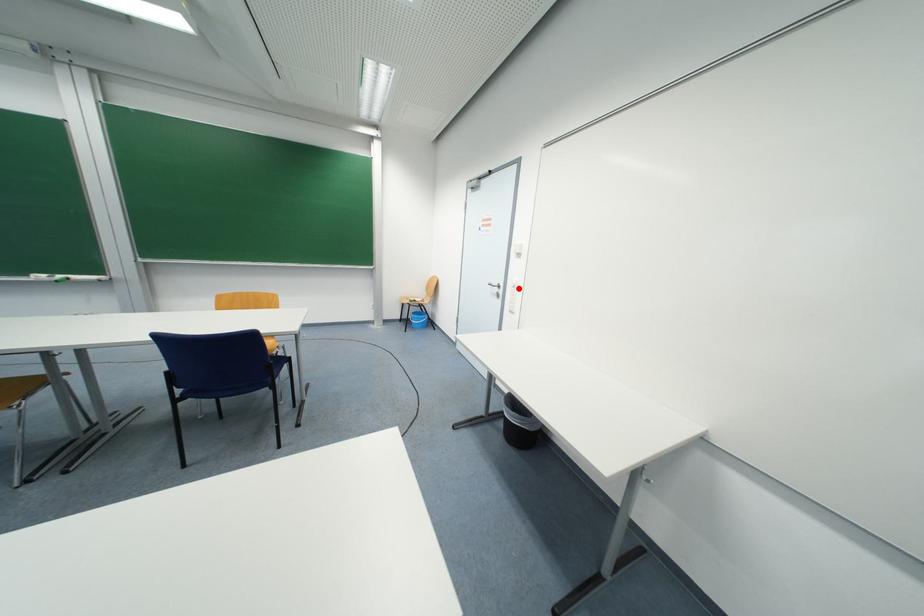
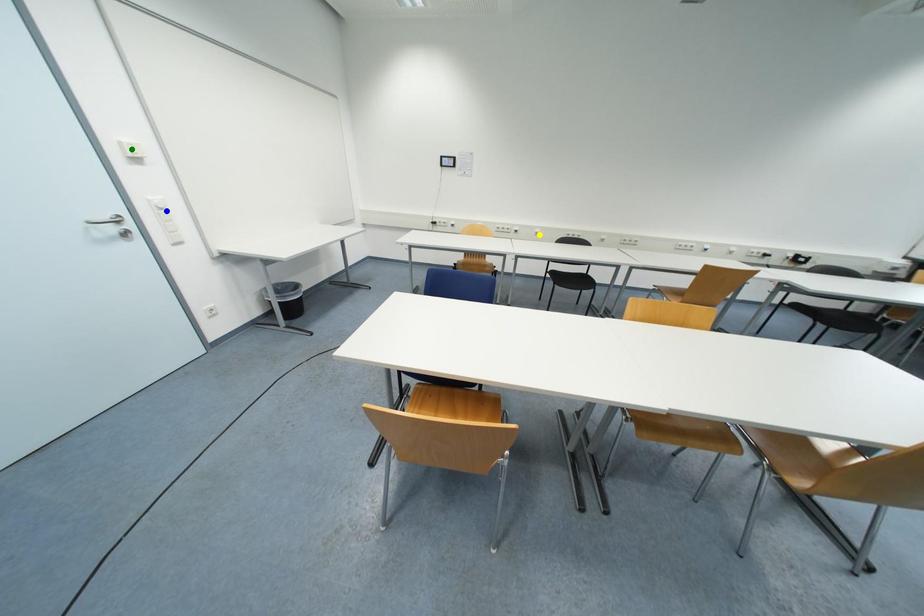
Question: I am providing you with two images of the same scene from different viewpoints. A red point is marked on the first image. You are given multiple points on the second image. Which point in image 2 is actually the same real-world point as the red point in image 1?

Choices:
 (A) yellow point
 (B) green point
 (C) blue point

Answer: (C)